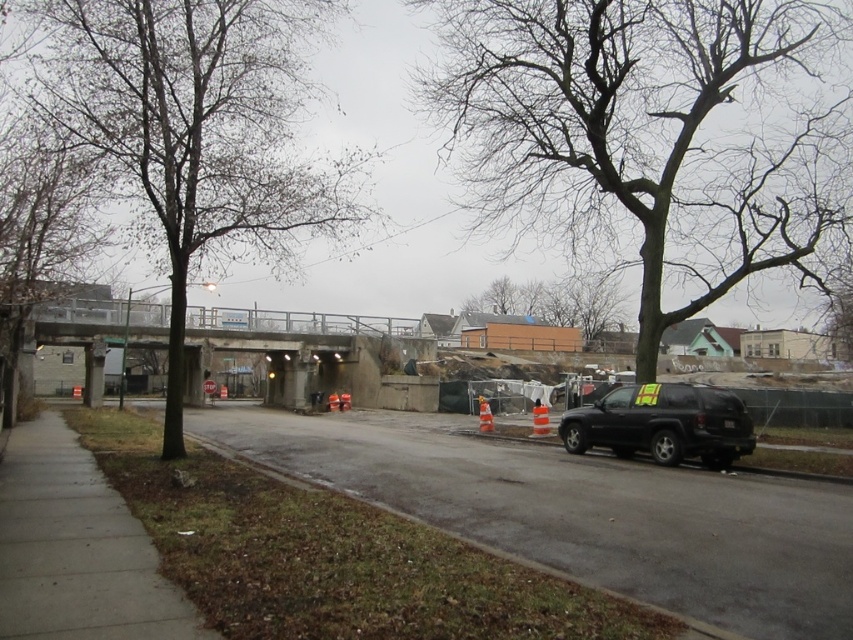
Question: Does gray concrete sidewalk at lower left appear on the left side of brown wooden fence at center?

Choices:
 (A) no
 (B) yes

Answer: (B)

Question: Based on their relative distances, which object is nearer to the bare wood tree at left?

Choices:
 (A) gray asphalt road at center
 (B) black matte suv at right
 (C) bare wood tree at upper right
 (D) gray concrete sidewalk at lower left

Answer: (D)

Question: From the image, what is the correct spatial relationship of bare wood tree at upper right in relation to gray asphalt road at center?

Choices:
 (A) left
 (B) right

Answer: (B)

Question: Which point is closer to the camera taking this photo?

Choices:
 (A) (25, 234)
 (B) (616, 422)

Answer: (B)

Question: Does black matte suv at right have a greater width compared to brown wooden fence at center?

Choices:
 (A) yes
 (B) no

Answer: (B)

Question: Which point is closer to the camera taking this photo?

Choices:
 (A) (567, 280)
 (B) (265, 104)
 (C) (630, 397)
 (D) (419, 424)

Answer: (B)